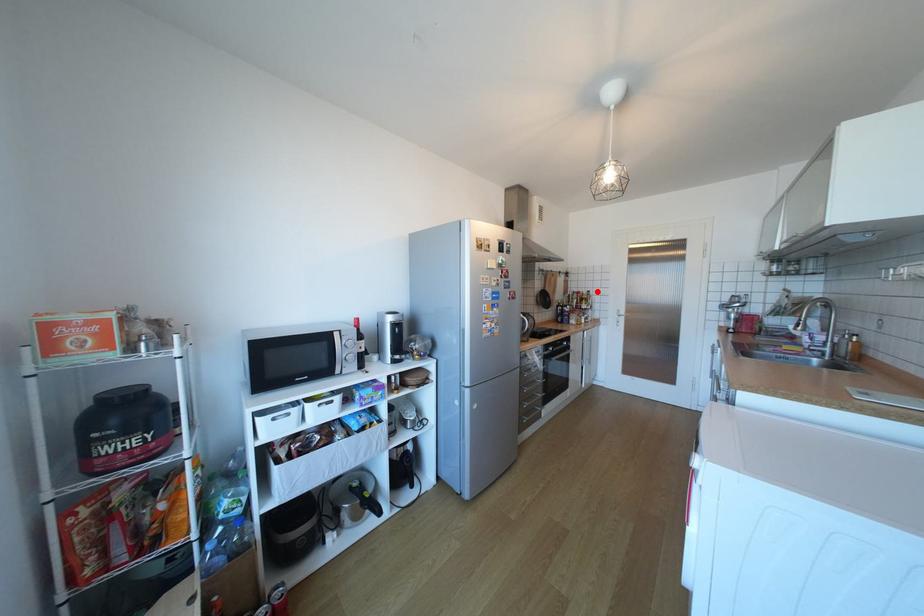
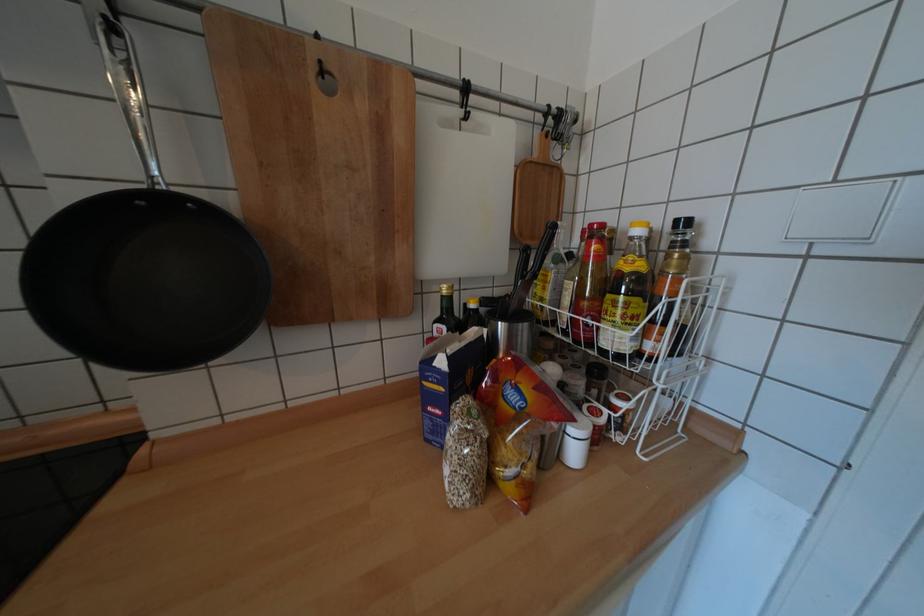
Find the pixel in the second image that matches the highlighted location in the first image.

(694, 224)